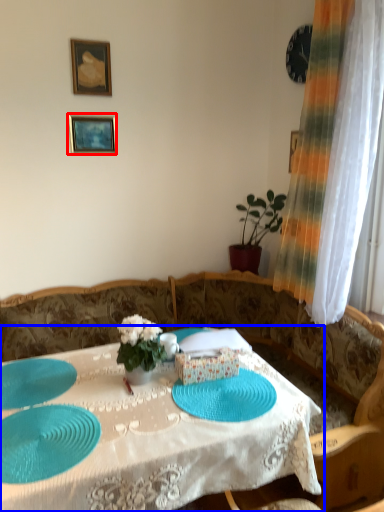
Question: Which object is further to the camera taking this photo, picture frame (highlighted by a red box) or table (highlighted by a blue box)?

Choices:
 (A) picture frame
 (B) table

Answer: (A)